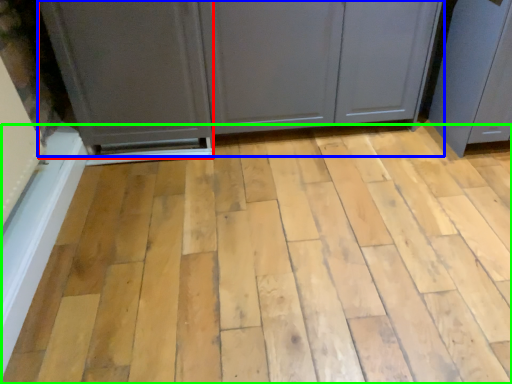
Question: Based on their relative distances, which object is nearer to screen door (highlighted by a red box)? Choose from cupboard (highlighted by a blue box) and plank (highlighted by a green box).

Choices:
 (A) cupboard
 (B) plank

Answer: (A)